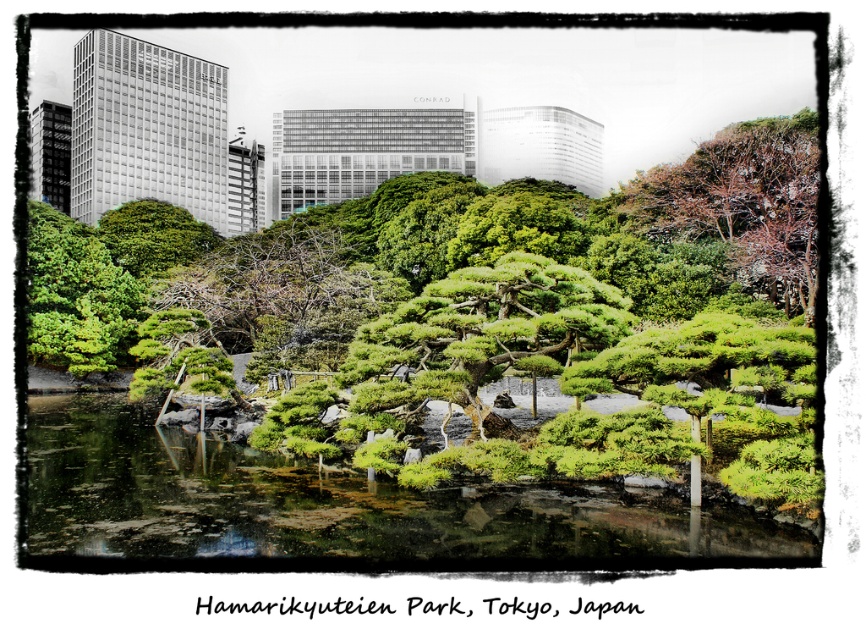
Is green textured bonsai tree at center to the left of green mossy water at lower center from the viewer's perspective?

No, green textured bonsai tree at center is not to the left of green mossy water at lower center.

Does green textured bonsai tree at center appear on the right side of green mossy water at lower center?

Yes, green textured bonsai tree at center is to the right of green mossy water at lower center.

Who is more forward, [785,228] or [36,465]?

Point [36,465] is more forward.

Where is `green textured bonsai tree at center`? The width and height of the screenshot is (866, 640). green textured bonsai tree at center is located at coordinates (509, 284).

Is green textured bonsai tree at center smaller than green textured tree at center?

Actually, green textured bonsai tree at center might be larger than green textured tree at center.

Between point (559, 250) and point (585, 333), which one is positioned in front?

Point (585, 333) is more forward.

Measure the distance between point (x=341, y=212) and camera.

Point (x=341, y=212) is 81.50 meters from camera.

You are a GUI agent. You are given a task and a screenshot of the screen. Output one action in this format:
    pyautogui.click(x=<x>, y=<y>)
    Task: Click on the green textured bonsai tree at center
    The image size is (866, 640).
    Given the screenshot: What is the action you would take?
    pyautogui.click(x=509, y=284)

Who is lower down, green mossy water at lower center or green textured tree at center?

green mossy water at lower center is lower down.

Who is higher up, green mossy water at lower center or green textured tree at center?

green textured tree at center is higher up.

Locate an element on the screen. The height and width of the screenshot is (640, 866). green mossy water at lower center is located at coordinates (339, 506).

Locate an element on the screen. Image resolution: width=866 pixels, height=640 pixels. green mossy water at lower center is located at coordinates (339, 506).